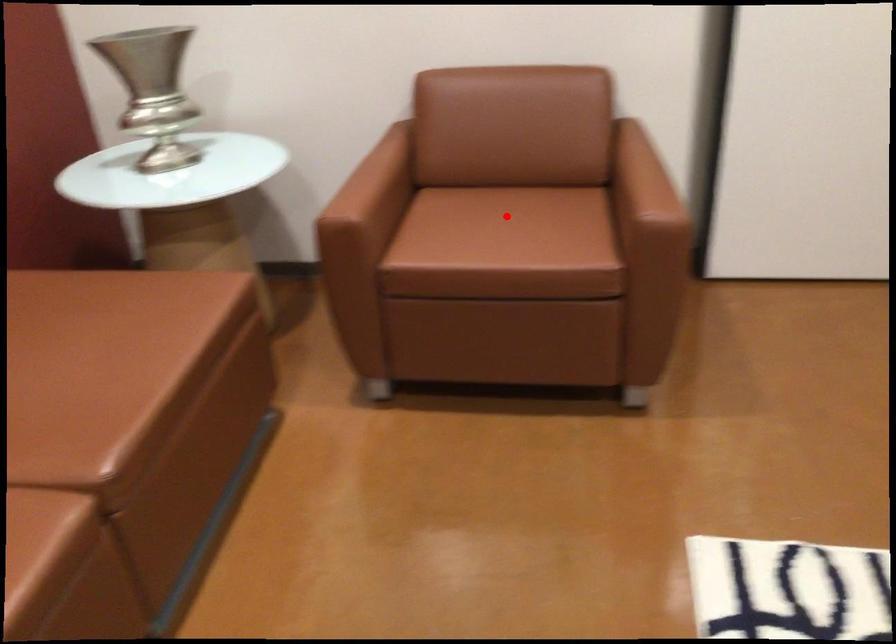
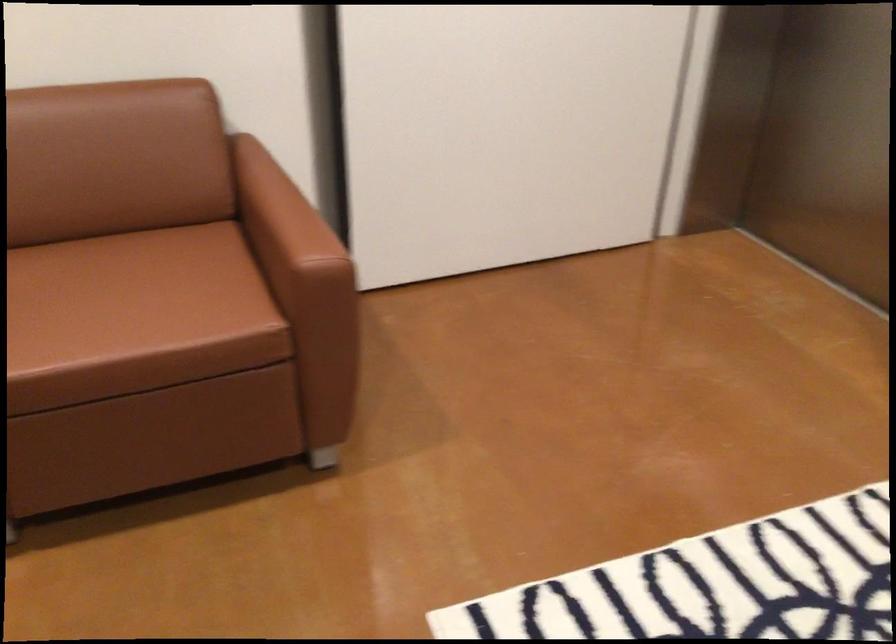
Question: I am providing you with two images of the same scene from different viewpoints. Image1 has a red point marked. In image2, the corresponding 3D location appears at what relative position? Reply with the corresponding letter.

Choices:
 (A) Closer
 (B) Farther

Answer: (A)